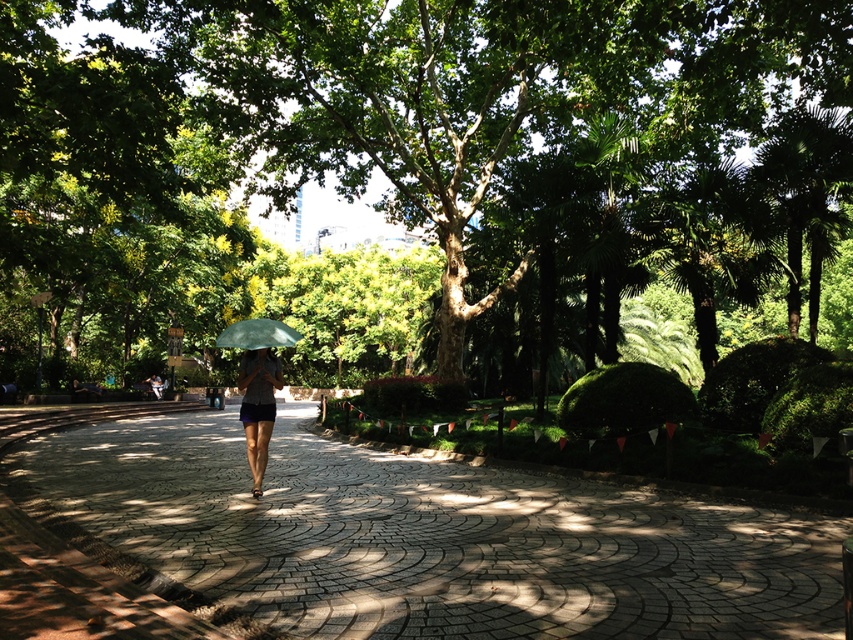
Is dark gray fabric umbrella at center taller than green matte umbrella at center?

Indeed, dark gray fabric umbrella at center has a greater height compared to green matte umbrella at center.

The image size is (853, 640). I want to click on dark gray fabric umbrella at center, so click(x=258, y=406).

Is point (251, 396) closer to camera compared to point (236, 326)?

Yes, point (251, 396) is in front of point (236, 326).

Locate an element on the screen. The height and width of the screenshot is (640, 853). dark gray fabric umbrella at center is located at coordinates (258, 406).

Is green leafy tree at center behind green matte umbrella at center?

Yes, it is.

How distant is green leafy tree at center from green matte umbrella at center?

A distance of 54.33 feet exists between green leafy tree at center and green matte umbrella at center.

This screenshot has width=853, height=640. I want to click on green leafy tree at center, so click(x=401, y=170).

Does green leafy tree at center appear on the left side of dark gray fabric umbrella at center?

Indeed, green leafy tree at center is positioned on the left side of dark gray fabric umbrella at center.

Describe the element at coordinates (401, 170) in the screenshot. I see `green leafy tree at center` at that location.

The height and width of the screenshot is (640, 853). Find the location of `green leafy tree at center`. green leafy tree at center is located at coordinates (401, 170).